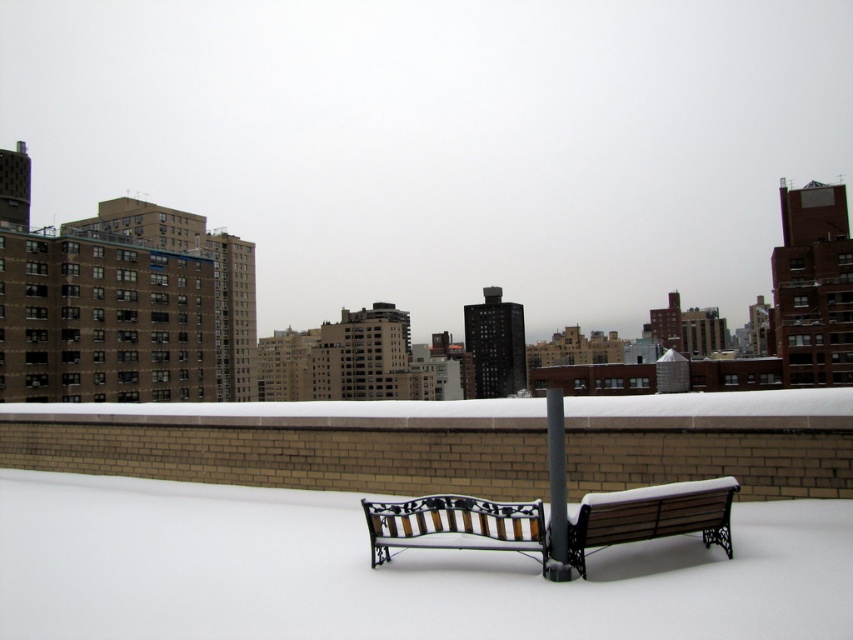
You are standing on the rooftop and want to walk from point A to point B. Point A is located at coordinates point (714,497) and point B is at point (556,541). Since you want to avoid walking too far, which direction should you move from point A to reach point B?

→ To move from point A to point B, you should move downward and to the right because point A is further to the camera than point B, so moving towards the lower right direction would lead you closer to point B.

Looking at this image, you are a maintenance worker needing to reach the black metal pole at center from the white fluffy snow at center. Can you walk directly to it without stepping on any other objects?

The white fluffy snow at center and black metal pole at center are 3.00 meters apart from each other, so yes, you can walk directly to the black metal pole at center from the white fluffy snow at center without stepping on any other objects as there are no obstacles mentioned between them.